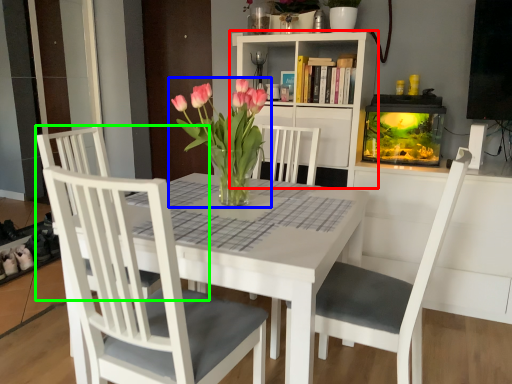
Question: Which is farther away from bookcase (highlighted by a red box)? houseplant (highlighted by a blue box) or chair (highlighted by a green box)?

Choices:
 (A) houseplant
 (B) chair

Answer: (B)